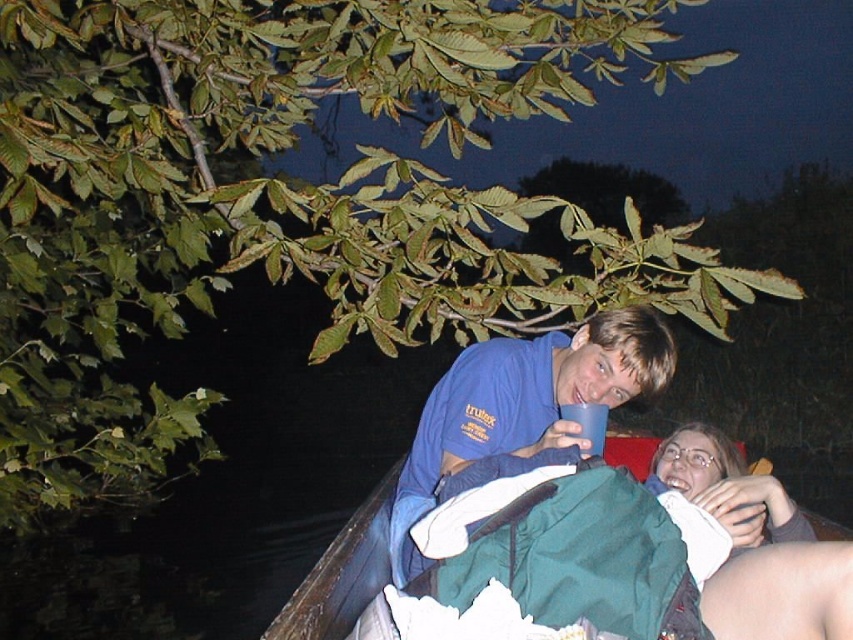
Question: Can you confirm if blue cotton shirt at upper center is positioned above blue plastic cup at upper center?

Choices:
 (A) yes
 (B) no

Answer: (B)

Question: Which of these objects is positioned farthest from the green fabric jacket at lower right?

Choices:
 (A) blue cotton shirt at upper center
 (B) blue plastic cup at upper center

Answer: (A)

Question: Can you confirm if blue cotton shirt at upper center is positioned to the right of green fabric jacket at lower right?

Choices:
 (A) no
 (B) yes

Answer: (A)

Question: Does blue cotton shirt at upper center lie behind blue plastic cup at upper center?

Choices:
 (A) yes
 (B) no

Answer: (A)

Question: Which point appears closest to the camera in this image?

Choices:
 (A) (444, 380)
 (B) (572, 419)

Answer: (B)

Question: Which of the following is the closest to the observer?

Choices:
 (A) blue cotton shirt at upper center
 (B) green fabric jacket at lower right

Answer: (B)